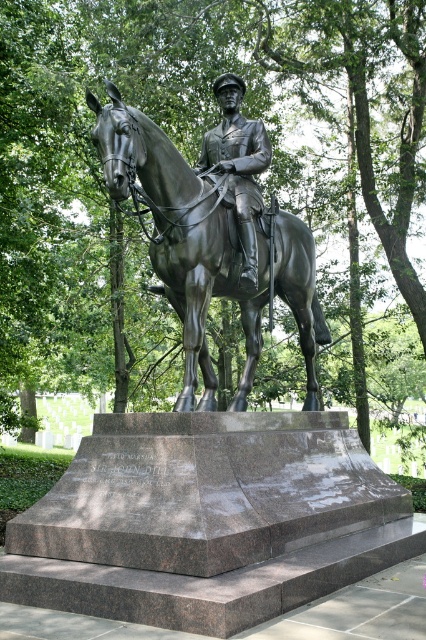
Between bronze statue of horse at center and bronze statue at center, which one has less height?

bronze statue at center is shorter.

Can you confirm if bronze statue of horse at center is taller than bronze statue at center?

Yes.

Which is in front, point (169, 161) or point (236, 173)?

Positioned in front is point (169, 161).

Identify the location of bronze statue of horse at center. (207, 248).